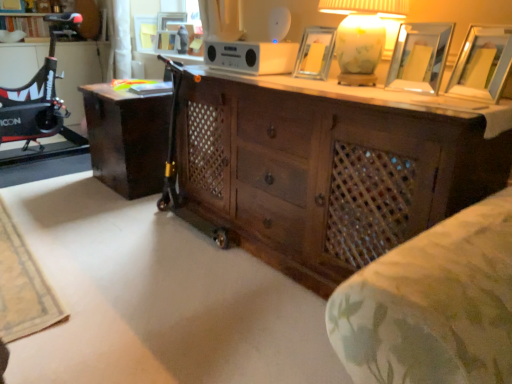
What do you see at coordinates (320, 172) in the screenshot? I see `dark wood chest of drawers at center` at bounding box center [320, 172].

Image resolution: width=512 pixels, height=384 pixels. I want to click on metallic silver picture frame at upper center, the third picture frame from the left, so click(x=315, y=53).

What do you see at coordinates (419, 57) in the screenshot? Image resolution: width=512 pixels, height=384 pixels. I see `metallic silver picture frame at upper right, acting as the fourth picture frame starting from the back` at bounding box center [419, 57].

The height and width of the screenshot is (384, 512). Identify the location of wooden picture frame at upper right, acting as the 1th picture frame starting from the right. (482, 64).

The image size is (512, 384). I want to click on dark wood chest of drawers at center, so click(320, 172).

From a real-world perspective, between matte white picture frame at upper center, the first picture frame in the back-to-front sequence, and wooden picture frame at upper center, which is the 4th picture frame in bottom-to-top order, who is vertically higher?

matte white picture frame at upper center, the first picture frame in the back-to-front sequence, is physically above.

Are matte white picture frame at upper center, which is counted as the 5th picture frame, starting from the right, and wooden picture frame at upper center, which is counted as the fourth picture frame, starting from the right, located far from each other?

They are positioned close to each other.

Is dark wood chest of drawers at center facing away from metallic silver picture frame at upper right, arranged as the second picture frame when viewed from the right?

No.

Consider the image. Can you confirm if dark wood chest of drawers at center is taller than metallic silver picture frame at upper right, which ranks as the 4th picture frame in top-to-bottom order?

Correct, dark wood chest of drawers at center is much taller as metallic silver picture frame at upper right, which ranks as the 4th picture frame in top-to-bottom order.

Does dark wood chest of drawers at center have a larger size compared to metallic silver picture frame at upper right, arranged as the second picture frame when viewed from the right?

Yes.

Considering the positions of points (490, 168) and (432, 31), is point (490, 168) farther from camera compared to point (432, 31)?

No, it is in front of (432, 31).

Measure the distance between dark wood chest of drawers at center and matte white picture frame at upper center, the first picture frame in the back-to-front sequence.

dark wood chest of drawers at center and matte white picture frame at upper center, the first picture frame in the back-to-front sequence, are 2.18 meters apart from each other.

From the image's perspective, between dark wood chest of drawers at center and matte white picture frame at upper center, which is counted as the 5th picture frame, starting from the right, who is located below?

dark wood chest of drawers at center appears lower in the image.

Starting from the dark wood chest of drawers at center, which picture frame is the 2nd one to the left? Please provide its 2D coordinates.

[(145, 33)]

Based on the photo, which point is more forward, (258, 254) or (137, 30)?

The point (258, 254) is more forward.

From the image's perspective, would you say wooden picture frame at upper right, arranged as the fifth picture frame when viewed from the back, is positioned over metallic silver picture frame at upper center, the third picture frame in the right-to-left sequence?

Actually, wooden picture frame at upper right, arranged as the fifth picture frame when viewed from the back, appears below metallic silver picture frame at upper center, the third picture frame in the right-to-left sequence, in the image.

Based on the photo, who is shorter, wooden picture frame at upper right, positioned as the 5th picture frame in top-to-bottom order, or metallic silver picture frame at upper center, which appears as the third picture frame when ordered from the bottom?

metallic silver picture frame at upper center, which appears as the third picture frame when ordered from the bottom.

Where is `picture frame that is the 2nd one when counting downward from the metallic silver picture frame at upper center, the third picture frame from the front (from the image's perspective)`? picture frame that is the 2nd one when counting downward from the metallic silver picture frame at upper center, the third picture frame from the front (from the image's perspective) is located at coordinates (482, 64).

Is wooden picture frame at upper right, which ranks as the fifth picture frame in left-to-right order, inside or outside of metallic silver picture frame at upper center, the third picture frame from the front?

wooden picture frame at upper right, which ranks as the fifth picture frame in left-to-right order, lies outside metallic silver picture frame at upper center, the third picture frame from the front.

Which object is thinner, dark wood desk at center or metallic silver picture frame at upper right, which ranks as the 4th picture frame in top-to-bottom order?

metallic silver picture frame at upper right, which ranks as the 4th picture frame in top-to-bottom order.

Looking at the image, does dark wood desk at center seem bigger or smaller compared to metallic silver picture frame at upper right, acting as the fourth picture frame starting from the back?

Considering their sizes, dark wood desk at center takes up more space than metallic silver picture frame at upper right, acting as the fourth picture frame starting from the back.

How far apart are dark wood desk at center and metallic silver picture frame at upper right, positioned as the 2th picture frame in front-to-back order?

A distance of 1.61 meters exists between dark wood desk at center and metallic silver picture frame at upper right, positioned as the 2th picture frame in front-to-back order.

Considering the positions of points (89, 85) and (450, 24), is point (89, 85) closer to camera compared to point (450, 24)?

No, it is behind (450, 24).

Between wooden picture frame at upper right, which ranks as the fifth picture frame in left-to-right order, and dark wood desk at center, which one appears on the left side from the viewer's perspective?

Positioned to the left is dark wood desk at center.

Find the location of `desk behind the wooden picture frame at upper right, which is the 1th picture frame from front to back`. desk behind the wooden picture frame at upper right, which is the 1th picture frame from front to back is located at coordinates (127, 139).

Can you confirm if wooden picture frame at upper right, arranged as the fifth picture frame when viewed from the back, is wider than dark wood desk at center?

Incorrect, the width of wooden picture frame at upper right, arranged as the fifth picture frame when viewed from the back, does not surpass that of dark wood desk at center.

Is the surface of wooden picture frame at upper right, acting as the 1th picture frame starting from the bottom, in direct contact with dark wood desk at center?

wooden picture frame at upper right, acting as the 1th picture frame starting from the bottom, and dark wood desk at center are not in contact.

From a real-world perspective, starting from the matte glass table lamp at upper right, which picture frame is the 5th one below it? Please provide its 2D coordinates.

[(167, 42)]

Considering the positions of point (163, 33) and point (351, 41), is point (163, 33) closer or farther from the camera than point (351, 41)?

Point (163, 33) is positioned farther from the camera compared to point (351, 41).

How different are the orientations of wooden picture frame at upper center, which ranks as the second picture frame in top-to-bottom order, and matte glass table lamp at upper right in degrees?

21.8 degrees.

In the scene shown: Considering the relative sizes of wooden picture frame at upper center, which is counted as the second picture frame, starting from the left, and matte glass table lamp at upper right in the image provided, is wooden picture frame at upper center, which is counted as the second picture frame, starting from the left, thinner than matte glass table lamp at upper right?

Yes, wooden picture frame at upper center, which is counted as the second picture frame, starting from the left, is thinner than matte glass table lamp at upper right.

Identify the location of picture frame behind the wooden picture frame at upper center, which is the 4th picture frame in bottom-to-top order. The width and height of the screenshot is (512, 384). (145, 33).

The height and width of the screenshot is (384, 512). I want to click on chest of drawers that appears on the left of metallic silver picture frame at upper right, the 4th picture frame viewed from the left, so click(320, 172).

From the image, which object appears to be farther from matte glass table lamp at upper right, metallic silver picture frame at upper right, which ranks as the 4th picture frame in top-to-bottom order, or dark wood chest of drawers at center?

Among the two, dark wood chest of drawers at center is located further to matte glass table lamp at upper right.

From the picture: When comparing their distances from metallic silver picture frame at upper center, the third picture frame in the right-to-left sequence, does dark wood chest of drawers at center or dark wood desk at center seem closer?

dark wood chest of drawers at center is closer to metallic silver picture frame at upper center, the third picture frame in the right-to-left sequence.

From the image, which object appears to be farther from metallic silver picture frame at upper right, which is counted as the second picture frame, starting from the bottom, matte glass table lamp at upper right or dark wood chest of drawers at center?

dark wood chest of drawers at center is further to metallic silver picture frame at upper right, which is counted as the second picture frame, starting from the bottom.

From the image, which object appears to be farther from dark wood desk at center, wooden picture frame at upper right, which is the 1th picture frame from front to back, or matte glass table lamp at upper right?

The object further to dark wood desk at center is wooden picture frame at upper right, which is the 1th picture frame from front to back.

From the image, which object appears to be nearer to dark wood desk at center, metallic silver picture frame at upper right, which ranks as the 4th picture frame in top-to-bottom order, or matte glass table lamp at upper right?

matte glass table lamp at upper right is positioned closer to the anchor dark wood desk at center.

Which object lies further to the anchor point matte glass table lamp at upper right, dark wood chest of drawers at center or wooden picture frame at upper right, positioned as the 5th picture frame in top-to-bottom order?

dark wood chest of drawers at center lies further to matte glass table lamp at upper right than the other object.

Which object lies further to the anchor point metallic silver picture frame at upper center, the third picture frame in the right-to-left sequence, wooden picture frame at upper right, acting as the 1th picture frame starting from the bottom, or dark wood chest of drawers at center?

wooden picture frame at upper right, acting as the 1th picture frame starting from the bottom, lies further to metallic silver picture frame at upper center, the third picture frame in the right-to-left sequence, than the other object.

From the image, which object appears to be farther from matte white picture frame at upper center, the first picture frame in the back-to-front sequence, matte glass table lamp at upper right or metallic silver picture frame at upper center, which appears as the third picture frame when ordered from the bottom?

The object further to matte white picture frame at upper center, the first picture frame in the back-to-front sequence, is matte glass table lamp at upper right.

I want to click on table lamp situated between dark wood chest of drawers at center and wooden picture frame at upper right, which is the 1th picture frame from front to back, from left to right, so tap(361, 36).

This screenshot has height=384, width=512. What are the coordinates of `table lamp between wooden picture frame at upper right, acting as the 1th picture frame starting from the right, and wooden picture frame at upper center, which is counted as the second picture frame, starting from the back, from front to back` in the screenshot? It's located at (361, 36).

Find the location of a particular element. table lamp between dark wood desk at center and wooden picture frame at upper right, arranged as the fifth picture frame when viewed from the back, from left to right is located at coordinates (361, 36).

Locate an element on the screen. The width and height of the screenshot is (512, 384). desk between metallic silver picture frame at upper center, which appears as the third picture frame when ordered from the bottom, and matte white picture frame at upper center, which is counted as the 5th picture frame, starting from the right, in the front-back direction is located at coordinates (127, 139).